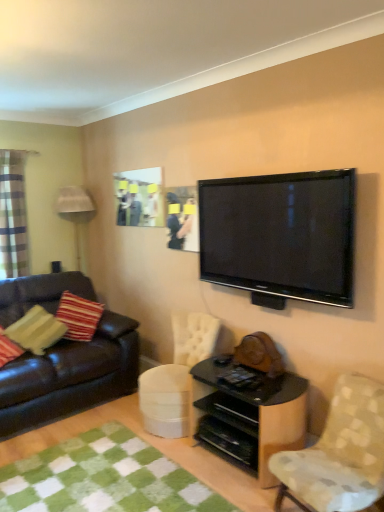
Question: Based on their positions, is black glossy shelf at lower center located to the left or right of matte plastic picture frame at upper center?

Choices:
 (A) right
 (B) left

Answer: (A)

Question: Is black glossy shelf at lower center bigger or smaller than matte plastic picture frame at upper center?

Choices:
 (A) big
 (B) small

Answer: (A)

Question: Considering the real-world distances, which object is closest to the black glossy tv at upper right?

Choices:
 (A) striped fabric pillow at left
 (B) matte plastic picture frame at upper center
 (C) leather couch at left
 (D) patterned fabric chair at lower right
 (E) green checkered rug at lower left

Answer: (D)

Question: Which is farther from the leather couch at left?

Choices:
 (A) matte plastic picture frame at upper center
 (B) black glossy shelf at lower center
 (C) black glossy tv at upper right
 (D) white fabric swivel chair at center
 (E) green checkered rug at lower left

Answer: (C)